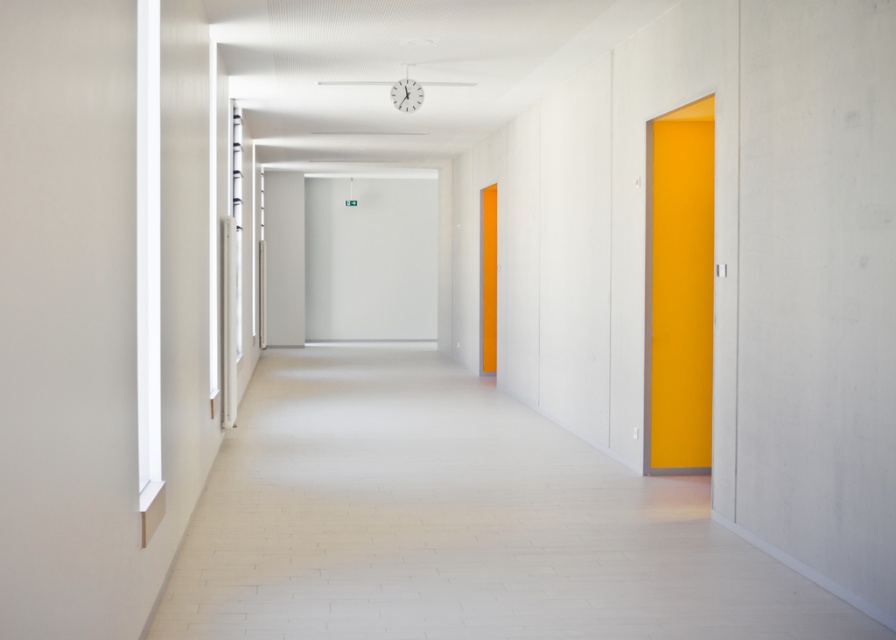
You are a delivery person carrying a package that requires moving through the corridor. The package is 2 meters long and needs to be transported from the yellow matte door at right to the orange matte door at center. Can you move the package horizontally through the corridor without tilting it?

The distance between the yellow matte door at right and the orange matte door at center is 7.46 meters. Since the package is only 2 meters long, there is sufficient space to move it horizontally without tilting. The corridor length is more than enough to accommodate the package.

Looking at this image, you are standing in the corridor and need to find the yellow matte door at right and the orange matte door at center. Which door is closer to the floor?

The yellow matte door at right is located below orange matte door at center, so the yellow matte door at right is closer to the floor.

You are moving a 1.5 meter wide sofa through the corridor and need to pass through one of the doors. The yellow matte door at right and the orange matte door at center are both potential exits. Which door should you choose to ensure the sofa can fit through?

The yellow matte door at right is wider than the orange matte door at center. Since the sofa is 1.5 meters wide, you should choose the yellow matte door at right to ensure the sofa can fit through.